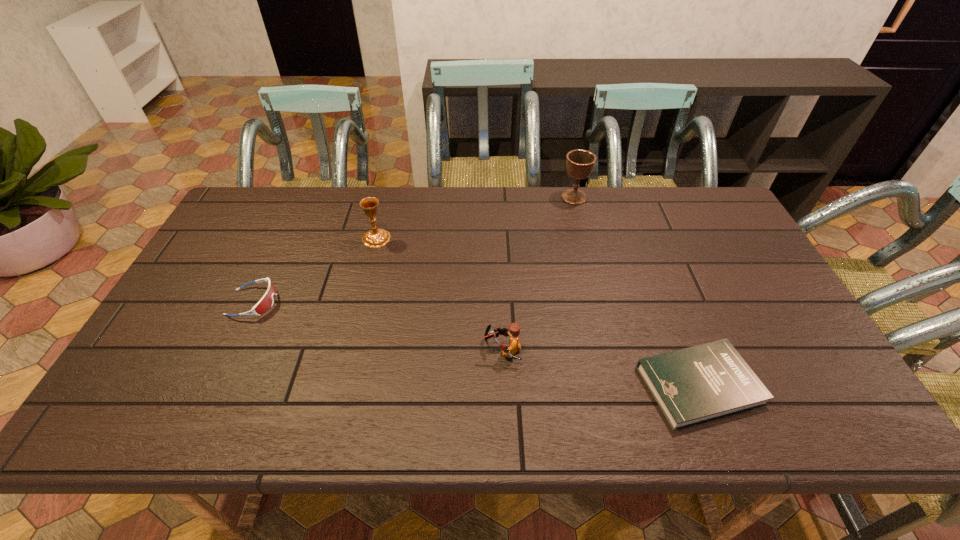
The height and width of the screenshot is (540, 960). Find the location of `vacant area that lies between the nearer chalice and the second shortest object`. vacant area that lies between the nearer chalice and the second shortest object is located at coordinates (315, 270).

Where is `free space between the fourth nearest object and the farther chalice`? Image resolution: width=960 pixels, height=540 pixels. free space between the fourth nearest object and the farther chalice is located at coordinates (475, 218).

Where is `unoccupied area between the shortest object and the third object from left to right`? The height and width of the screenshot is (540, 960). unoccupied area between the shortest object and the third object from left to right is located at coordinates (601, 367).

Image resolution: width=960 pixels, height=540 pixels. Find the location of `free space between the third farthest object and the farthest object`. free space between the third farthest object and the farthest object is located at coordinates (414, 249).

Find the location of a particular element. the second closest object to the third farthest object is located at coordinates (514, 329).

Locate an element on the screen. This screenshot has width=960, height=540. the third closest object to the right chalice is located at coordinates (700, 383).

Where is `free space that satisfies the following two spatial constraints: 1. on the back side of the book; 2. holding a crossbow in the hands of the third object from left to right`? This screenshot has height=540, width=960. free space that satisfies the following two spatial constraints: 1. on the back side of the book; 2. holding a crossbow in the hands of the third object from left to right is located at coordinates tap(685, 349).

This screenshot has width=960, height=540. I want to click on vacant space that satisfies the following two spatial constraints: 1. holding a crossbow in the hands of the third shortest object; 2. on the left side of the shortest object, so click(504, 385).

Where is `vacant position in the image that satisfies the following two spatial constraints: 1. holding a crossbow in the hands of the book; 2. on the left side of the third object from left to right`? The image size is (960, 540). vacant position in the image that satisfies the following two spatial constraints: 1. holding a crossbow in the hands of the book; 2. on the left side of the third object from left to right is located at coordinates click(x=504, y=385).